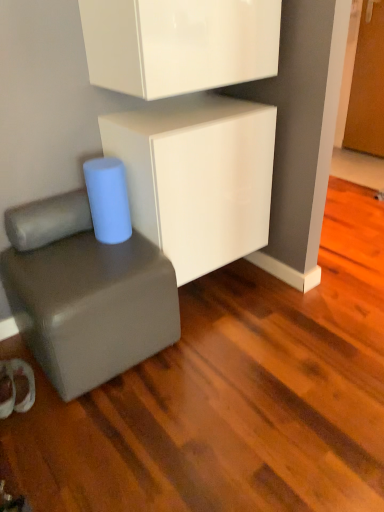
Where is `free point above matte gray cube at lower left (from a real-world perspective)`? The width and height of the screenshot is (384, 512). free point above matte gray cube at lower left (from a real-world perspective) is located at coordinates (77, 259).